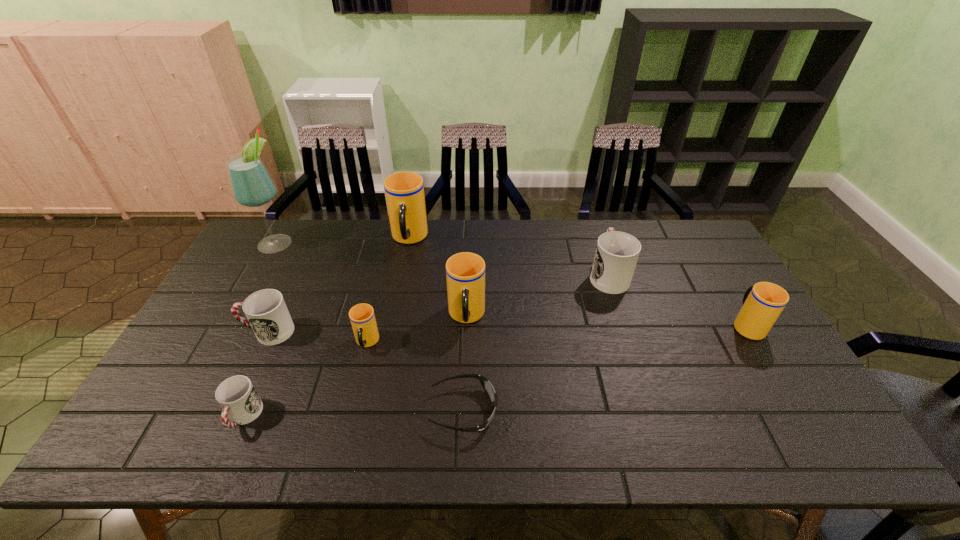
Identify the location of vacant space situated on the side of the rightmost object with the handle. The width and height of the screenshot is (960, 540). (727, 291).

Find the location of `free space located on the side of the rightmost object with the handle`. free space located on the side of the rightmost object with the handle is located at coordinates (702, 250).

Find the location of a particular element. This screenshot has width=960, height=540. free region located 0.210m on the side of the rightmost object with the handle is located at coordinates (710, 263).

This screenshot has width=960, height=540. What are the coordinates of `vacant region located 0.120m on the side of the second smallest red cup where the handle is located` in the screenshot? It's located at (200, 332).

The image size is (960, 540). In order to click on free space located on the side of the second smallest red cup where the handle is located in this screenshot , I will do tap(196, 332).

Where is `blank space located on the side of the smallest beige cup with the handle`? The image size is (960, 540). blank space located on the side of the smallest beige cup with the handle is located at coordinates (344, 437).

Find the location of a particular element. The height and width of the screenshot is (540, 960). vacant space located on the lenses of the sunglasses is located at coordinates (568, 410).

Find the location of a particular element. This screenshot has width=960, height=540. alcohol at the far edge is located at coordinates (252, 186).

Find the location of `cup positioned at the near edge`. cup positioned at the near edge is located at coordinates (237, 396).

Locate an element on the screen. The height and width of the screenshot is (540, 960). sunglasses at the near edge is located at coordinates (487, 386).